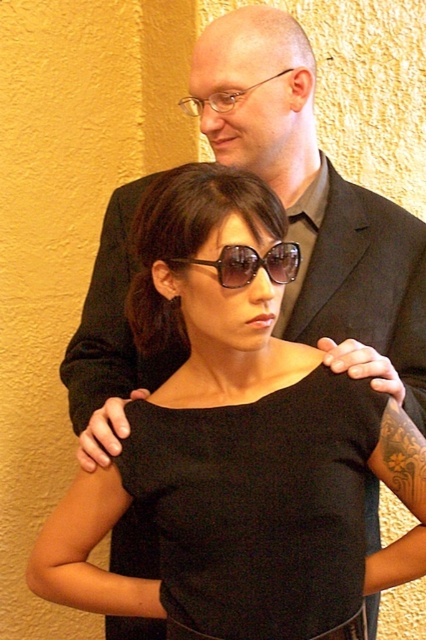
You are a photographer setting up a shoot in this scene. You need to place a small prop between the black matte dress at center and the clear plastic glasses at upper center. Based on their positions, where should you place the prop so it is between them?

The black matte dress at center is below the clear plastic glasses at upper center, so you should place the prop between them by positioning it above the black matte dress at center but below the clear plastic glasses at upper center.

You are a photographer setting up a shoot in this scene. You need to ensure that the black matte dress at center and the clear plastic glasses at upper center are both visible in the frame. Given their sizes, which object will require more horizontal space in the composition?

The black matte dress at center requires more horizontal space in the composition because its width surpasses that of the clear plastic glasses at upper center.